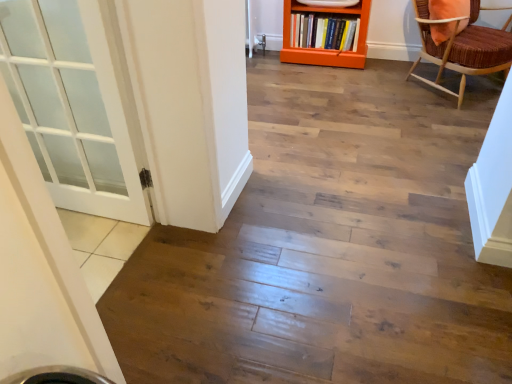
Question: Considering the relative sizes of brown woven chair at upper right and hardcover book at center in the image provided, is brown woven chair at upper right taller than hardcover book at center?

Choices:
 (A) no
 (B) yes

Answer: (B)

Question: Does brown woven chair at upper right appear on the right side of hardcover book at center?

Choices:
 (A) yes
 (B) no

Answer: (A)

Question: Is brown woven chair at upper right positioned behind hardcover book at center?

Choices:
 (A) yes
 (B) no

Answer: (B)

Question: Are brown woven chair at upper right and hardcover book at center making contact?

Choices:
 (A) yes
 (B) no

Answer: (B)

Question: Does brown woven chair at upper right have a larger size compared to hardcover book at center?

Choices:
 (A) no
 (B) yes

Answer: (B)

Question: Is brown woven chair at upper right not within hardcover book at center?

Choices:
 (A) no
 (B) yes

Answer: (B)

Question: Would you say hardcover book at center is outside brown woven chair at upper right?

Choices:
 (A) yes
 (B) no

Answer: (A)

Question: Does hardcover book at center have a larger size compared to brown woven chair at upper right?

Choices:
 (A) no
 (B) yes

Answer: (A)

Question: From the image's perspective, would you say hardcover book at center is positioned over brown woven chair at upper right?

Choices:
 (A) yes
 (B) no

Answer: (A)

Question: Does hardcover book at center appear on the right side of brown woven chair at upper right?

Choices:
 (A) no
 (B) yes

Answer: (A)

Question: Is hardcover book at center oriented towards brown woven chair at upper right?

Choices:
 (A) no
 (B) yes

Answer: (A)

Question: Can you confirm if hardcover book at center is positioned to the left of brown woven chair at upper right?

Choices:
 (A) no
 (B) yes

Answer: (B)

Question: Is orange wood bookcase at upper center shorter than brown woven chair at upper right?

Choices:
 (A) no
 (B) yes

Answer: (B)